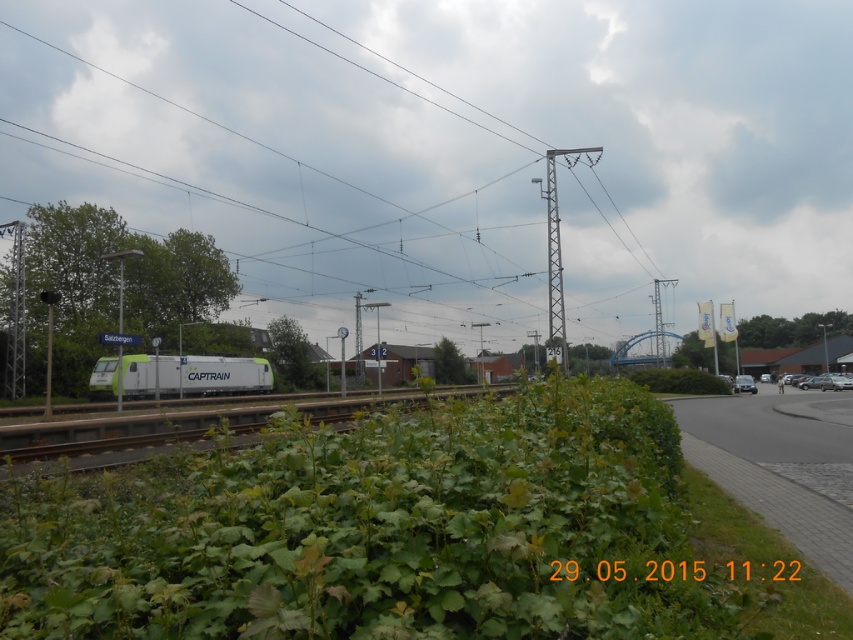
You are a maintenance worker checking the railway. You notice the green wire at center and the green matte train at center. Which object is positioned higher in the air?

The green wire at center is much taller than the green matte train at center, so the green wire at center is positioned higher in the air.

You are a maintenance worker checking the railway tracks. You notice the green wire at center and the green matte train at center. Which object is wider?

The green wire at center is wider than the green matte train at center according to the description.

You are a maintenance worker responsible for the railway tracks. You notice the green wire at center and the green matte train at center. According to safety regulations, the minimum safe distance between overhead wires and trains must be at least 250 feet. Is the current distance compliant with the safety standards?

The distance between the green wire at center and the green matte train at center is 267.55 feet, which exceeds the minimum required 250 feet. Therefore, the current distance complies with the safety standards.